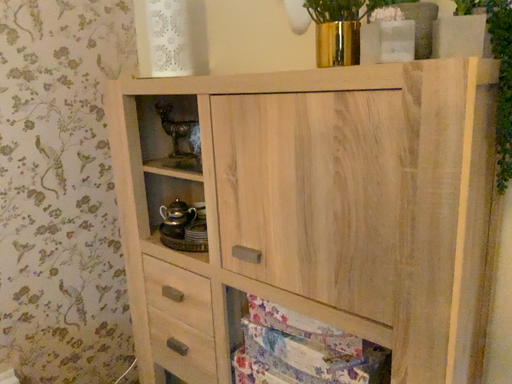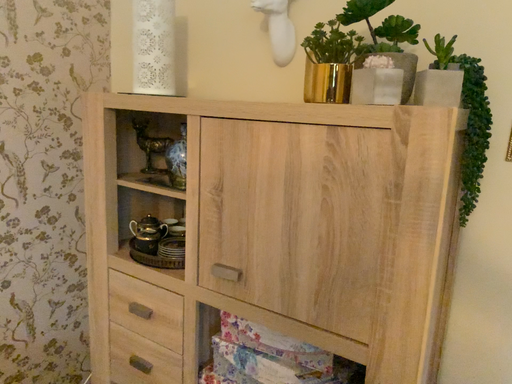
Question: Which way did the camera rotate in the video?

Choices:
 (A) rotated right
 (B) rotated left

Answer: (A)